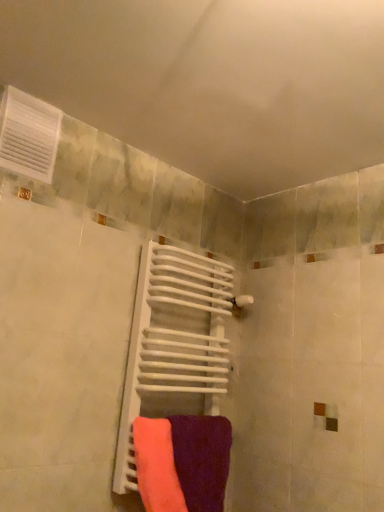
Question: Is white matte radiator at center to the left of white plastic vent at upper left from the viewer's perspective?

Choices:
 (A) yes
 (B) no

Answer: (B)

Question: From a real-world perspective, is white matte radiator at center physically above white plastic vent at upper left?

Choices:
 (A) no
 (B) yes

Answer: (A)

Question: Could white plastic vent at upper left be considered to be inside white matte radiator at center?

Choices:
 (A) yes
 (B) no

Answer: (B)

Question: From the image's perspective, is white matte radiator at center beneath white plastic vent at upper left?

Choices:
 (A) yes
 (B) no

Answer: (A)

Question: Are white matte radiator at center and white plastic vent at upper left located far from each other?

Choices:
 (A) no
 (B) yes

Answer: (A)

Question: Is white matte radiator at center not inside white plastic vent at upper left?

Choices:
 (A) yes
 (B) no

Answer: (A)

Question: Is the position of purple matte towel at center, the 2th towel when ordered from left to right, less distant than that of white matte radiator at center?

Choices:
 (A) yes
 (B) no

Answer: (A)

Question: Is purple matte towel at center, the 2th towel when ordered from left to right, to the right of white matte radiator at center from the viewer's perspective?

Choices:
 (A) yes
 (B) no

Answer: (A)

Question: Does purple matte towel at center, the first towel when ordered from right to left, come behind white matte radiator at center?

Choices:
 (A) yes
 (B) no

Answer: (B)

Question: Does purple matte towel at center, the first towel when ordered from right to left, have a greater height compared to white matte radiator at center?

Choices:
 (A) no
 (B) yes

Answer: (A)

Question: Is purple matte towel at center, the first towel when ordered from right to left, placed right next to white matte radiator at center?

Choices:
 (A) no
 (B) yes

Answer: (A)

Question: Is purple matte towel at center, the first towel when ordered from right to left, bigger than white matte radiator at center?

Choices:
 (A) no
 (B) yes

Answer: (A)

Question: Is the surface of purple matte towel at center, the 2th towel when ordered from left to right, in direct contact with neon pink fabric at center, which ranks as the 2th towel in right-to-left order?

Choices:
 (A) yes
 (B) no

Answer: (A)